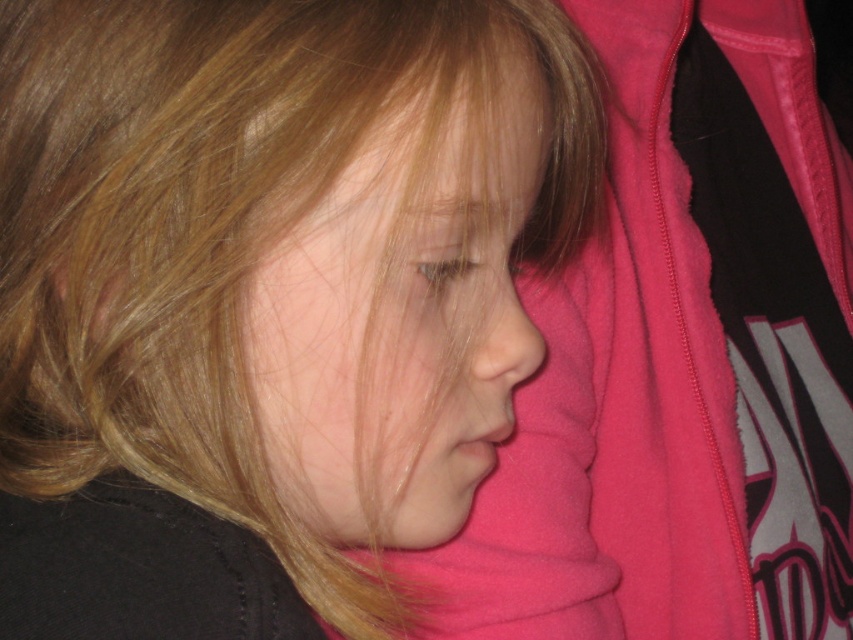
Question: Can you confirm if blonde smooth hair at center is smaller than smooth skin face at center?

Choices:
 (A) yes
 (B) no

Answer: (B)

Question: Which object appears farthest from the camera in this image?

Choices:
 (A) smooth skin face at center
 (B) blonde smooth hair at center

Answer: (A)

Question: Is blonde smooth hair at center thinner than smooth skin face at center?

Choices:
 (A) no
 (B) yes

Answer: (A)

Question: Among these objects, which one is nearest to the camera?

Choices:
 (A) smooth skin face at center
 (B) blonde smooth hair at center

Answer: (B)

Question: Can you confirm if blonde smooth hair at center is thinner than smooth skin face at center?

Choices:
 (A) no
 (B) yes

Answer: (A)